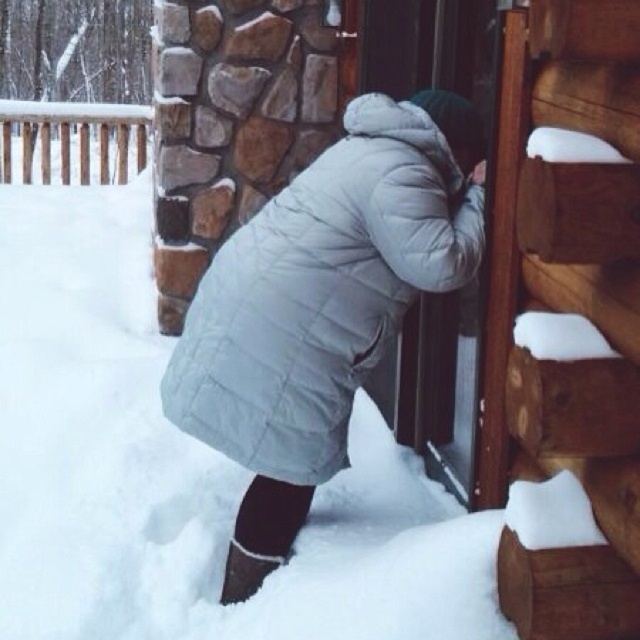
Question: Which object is farther from the camera taking this photo?

Choices:
 (A) white quilted jacket at center
 (B) white wooden railing at upper left

Answer: (B)

Question: Is white quilted jacket at center bigger than white wooden railing at upper left?

Choices:
 (A) yes
 (B) no

Answer: (B)

Question: Does white quilted jacket at center appear under white wooden railing at upper left?

Choices:
 (A) no
 (B) yes

Answer: (B)

Question: Which point appears closest to the camera in this image?

Choices:
 (A) (56, 161)
 (B) (173, 349)

Answer: (B)

Question: Can you confirm if white quilted jacket at center is positioned to the left of white wooden railing at upper left?

Choices:
 (A) yes
 (B) no

Answer: (B)